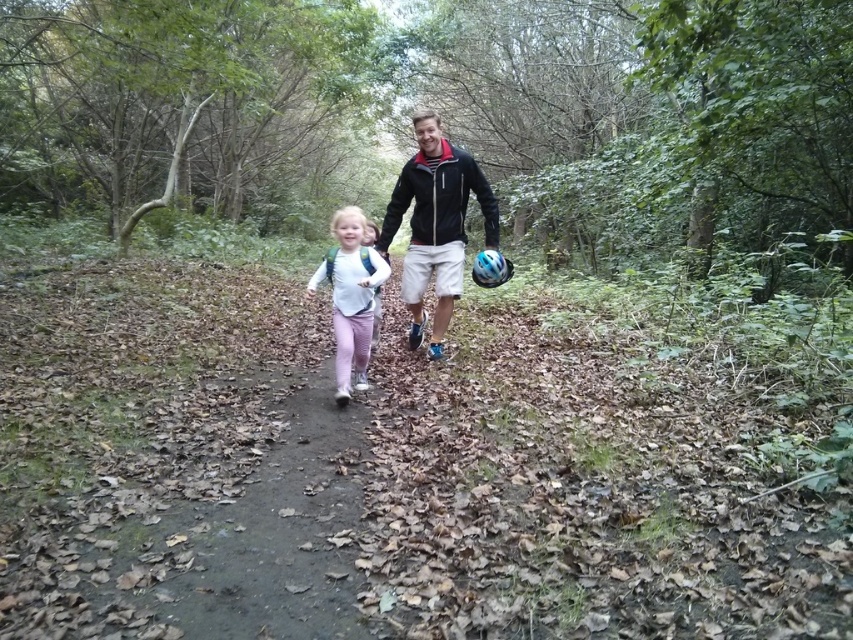
From the picture: What is located at the coordinates point (432, 106)?

The green matte forest at center is located at point (432, 106).

In the scene shown: You are a hiker trying to navigate through the green matte forest at center and the white matte shirt at center. Which one is wider?

The green matte forest at center is wider than the white matte shirt at center.